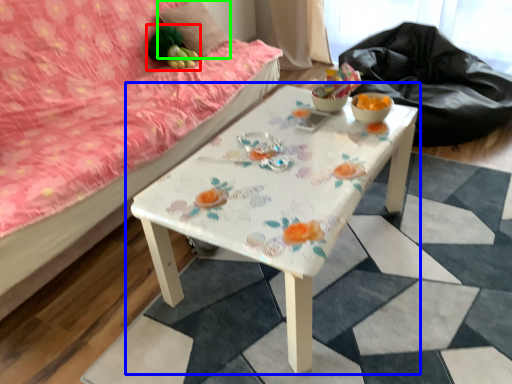
Question: Which object is positioned closest to toy (highlighted by a red box)? Select from table (highlighted by a blue box) and pillow (highlighted by a green box).

Choices:
 (A) table
 (B) pillow

Answer: (B)